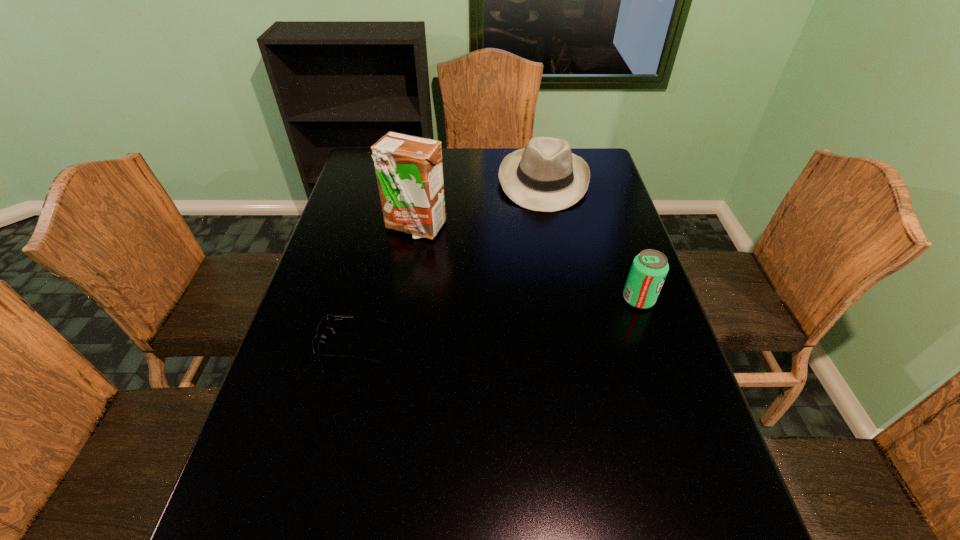
You are a GUI agent. You are given a task and a screenshot of the screen. Output one action in this format:
    pyautogui.click(x=<x>, y=<y>)
    Task: Click on the free location located on the front-facing side of the fedora
    
    Given the screenshot: What is the action you would take?
    pyautogui.click(x=544, y=232)

This screenshot has height=540, width=960. In order to click on object located in the far edge section of the desktop in this screenshot , I will do `click(546, 176)`.

This screenshot has width=960, height=540. In order to click on sunglasses located in the left edge section of the desktop in this screenshot , I will do `click(328, 320)`.

Locate an element on the screen. This screenshot has height=540, width=960. carton that is at the left edge is located at coordinates (409, 169).

Where is `pop soda positioned at the right edge`? pop soda positioned at the right edge is located at coordinates (649, 269).

Where is `fedora present at the right edge`? The height and width of the screenshot is (540, 960). fedora present at the right edge is located at coordinates (546, 176).

Where is `object at the far right corner`? This screenshot has width=960, height=540. object at the far right corner is located at coordinates (546, 176).

Where is `vacant region at the far edge of the desktop`? vacant region at the far edge of the desktop is located at coordinates (484, 165).

Find the location of a particular element. vacant area at the left edge of the desktop is located at coordinates (350, 193).

Identify the location of vacant area at the right edge. (677, 395).